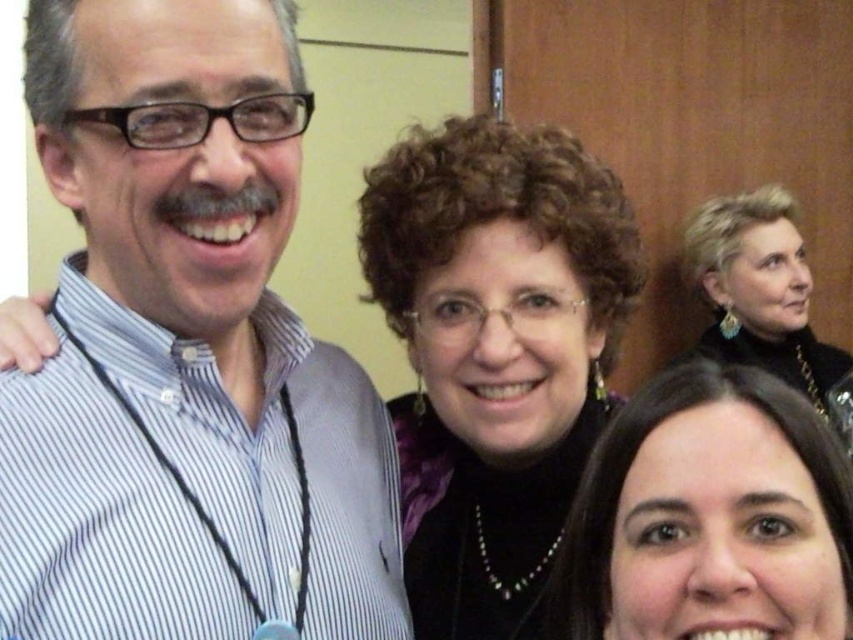
Question: Which point is closer to the camera?

Choices:
 (A) white striped shirt at left
 (B) black velvet blouse at center
 (C) satin black dress at upper right

Answer: (A)

Question: Which of the following is the closest to the observer?

Choices:
 (A) (418, 509)
 (B) (747, 481)
 (C) (717, 276)

Answer: (B)

Question: Can you confirm if black velvet blouse at center is bigger than satin black dress at upper right?

Choices:
 (A) no
 (B) yes

Answer: (A)

Question: Can you confirm if black velvet blouse at center is thinner than satin black dress at upper right?

Choices:
 (A) no
 (B) yes

Answer: (B)

Question: Is white striped shirt at left smaller than satin black dress at upper right?

Choices:
 (A) yes
 (B) no

Answer: (A)

Question: Considering the real-world distances, which object is farthest from the satin black dress at upper right?

Choices:
 (A) black velvet blouse at center
 (B) white striped shirt at left

Answer: (B)